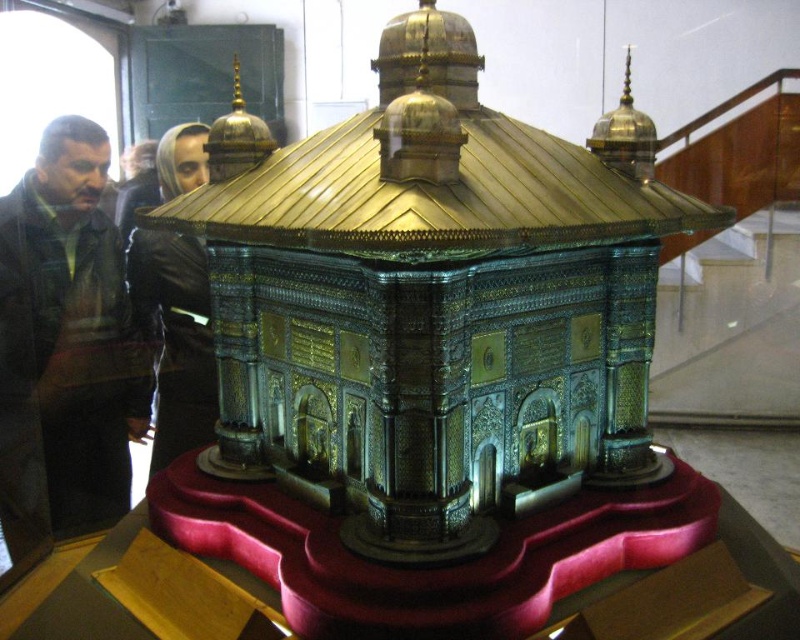
Between brushed metal jacket at left and black leather jacket at center, which one has less height?

black leather jacket at center is shorter.

Does brushed metal jacket at left appear on the left side of black leather jacket at center?

Indeed, brushed metal jacket at left is positioned on the left side of black leather jacket at center.

Image resolution: width=800 pixels, height=640 pixels. Describe the element at coordinates (72, 326) in the screenshot. I see `brushed metal jacket at left` at that location.

I want to click on brushed metal jacket at left, so click(72, 326).